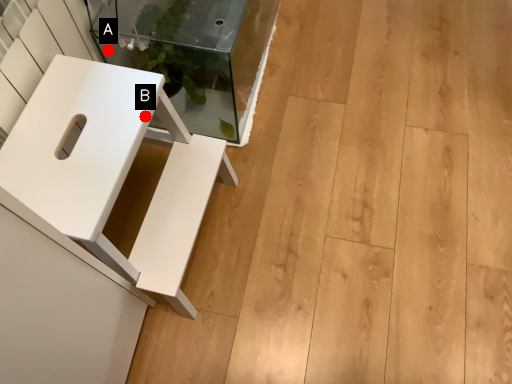
Question: Two points are circled on the image, labeled by A and B beside each circle. Which point is closer to the camera?

Choices:
 (A) A is closer
 (B) B is closer

Answer: (B)